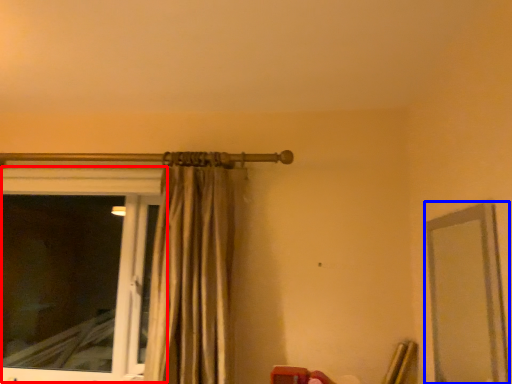
Question: Which object appears closest to the camera in this image, window (highlighted by a red box) or mirror (highlighted by a blue box)?

Choices:
 (A) window
 (B) mirror

Answer: (B)